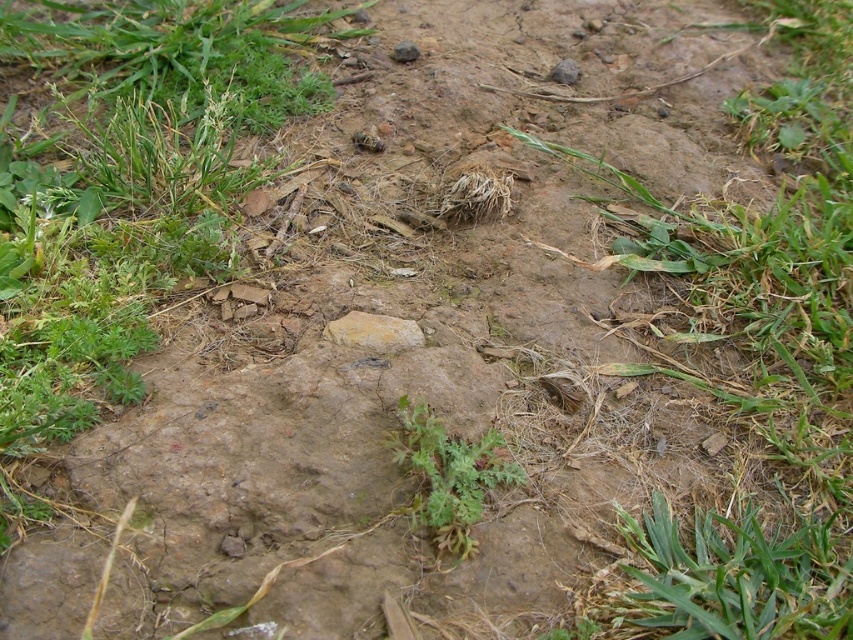
You are a gardener trying to determine the health of the plants in this area. Which object, the green grass at center or the yellowish rock at center, indicates better plant growth potential based on their height?

The green grass at center is much taller than the yellowish rock at center, indicating better plant growth potential in that area.

You are a gardener trying to determine which object is bigger between the green leafy grass at center and the yellowish rock at center. Which one is bigger?

The green leafy grass at center is larger in size than the yellowish rock at center.